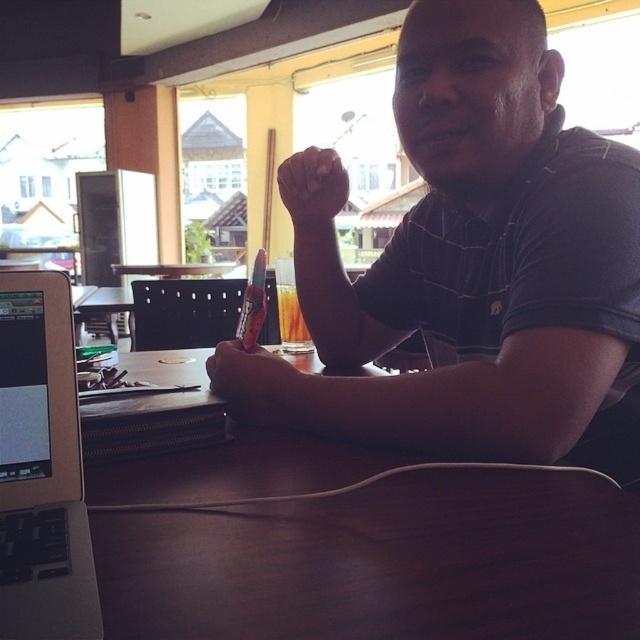
You are a person trying to grab the brown leather pen at center and the dark skin hand at center. Which object is closer to you?

The brown leather pen at center is closer to the viewer than the dark skin hand at center, so you can reach it first.

Based on the scene description, what are the coordinates of the matte black shirt at center?

The coordinates of the matte black shirt at center are at point (488,262).

You are a delivery robot in the scene. You need to deliver a package to the point at coordinates point (250, 381). However, there is an obstacle at point (317, 196). Can you reach the delivery point without going around the obstacle?

Point (250, 381) is in front of point (317, 196), so the delivery robot can reach the delivery point without needing to go around the obstacle since it is directly in front and not blocked by the obstacle.